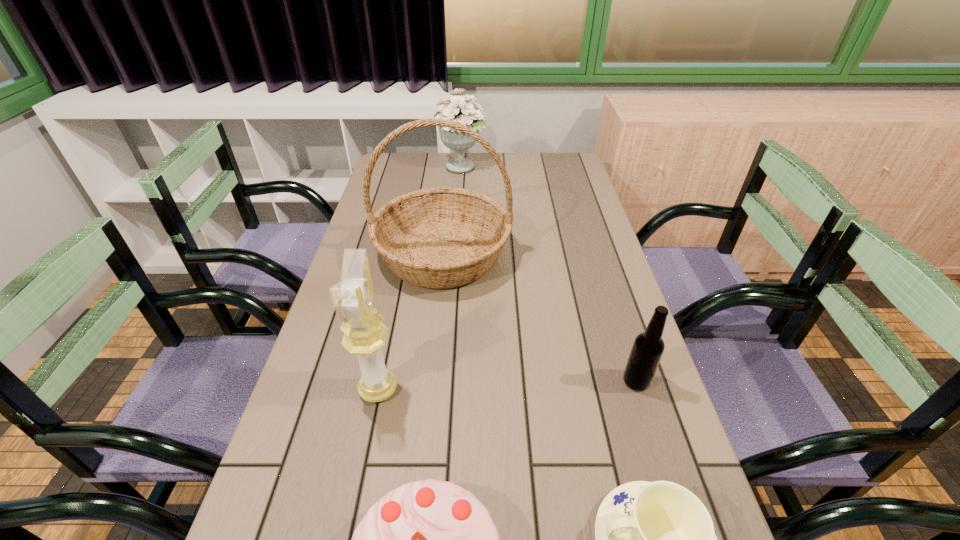
Locate an element on the screen. Image resolution: width=960 pixels, height=540 pixels. basket at the left edge is located at coordinates (444, 237).

The image size is (960, 540). I want to click on award present at the left edge, so click(x=353, y=297).

Locate an element on the screen. object located at the right edge is located at coordinates (647, 350).

You are a GUI agent. You are given a task and a screenshot of the screen. Output one action in this format:
    pyautogui.click(x=<x>, y=<y>)
    Task: Click on the blank space at the far edge of the desktop
    The height and width of the screenshot is (540, 960).
    Given the screenshot: What is the action you would take?
    pyautogui.click(x=449, y=158)

Where is `free space at the right edge of the desktop`? free space at the right edge of the desktop is located at coordinates (555, 188).

Identify the location of vacant area at the far left corner of the desktop. The image size is (960, 540). (421, 158).

This screenshot has width=960, height=540. I want to click on free area in between the fourth tallest object and the second farthest object, so click(x=540, y=318).

Locate an element on the screen. vacant space in between the third shortest object and the award is located at coordinates (507, 385).

You are a GUI agent. You are given a task and a screenshot of the screen. Output one action in this format:
    pyautogui.click(x=<x>, y=<y>)
    Task: Click on the vacant region between the tallest object and the third shortest object
    The height and width of the screenshot is (540, 960).
    Given the screenshot: What is the action you would take?
    pyautogui.click(x=540, y=318)

Where is `vacant area that lies between the basket and the beer bottle`? This screenshot has height=540, width=960. vacant area that lies between the basket and the beer bottle is located at coordinates (540, 318).